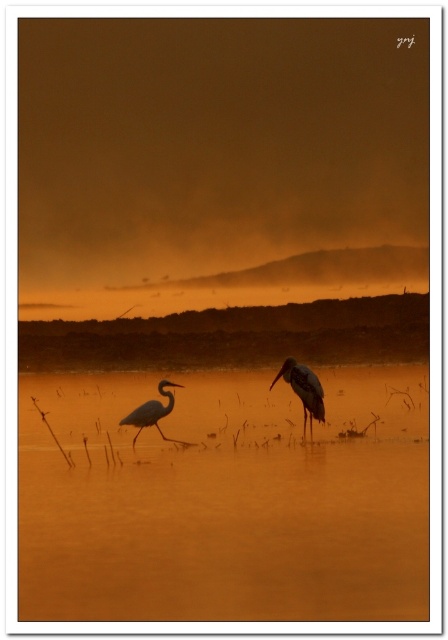
Who is more distant from viewer, (363, 577) or (318, 384)?

The point (318, 384) is behind.

Image resolution: width=448 pixels, height=640 pixels. Identify the location of golden smooth water at center. (225, 500).

Does point (358, 474) come closer to viewer compared to point (171, 404)?

Yes, it is.

Between golden smooth water at center and matte black heron at left, which one has less height?

matte black heron at left is shorter.

Where is `golden smooth water at center`? Image resolution: width=448 pixels, height=640 pixels. golden smooth water at center is located at coordinates (225, 500).

This screenshot has height=640, width=448. Identify the location of golden smooth water at center. click(x=225, y=500).

How distant is smooth gray heron at center from matte black heron at left?

smooth gray heron at center and matte black heron at left are 1.75 meters apart from each other.

At what (x,y) coordinates should I click in order to perform the action: click on smooth gray heron at center. Please return your answer as a coordinate pair (x, y). The height and width of the screenshot is (640, 448). Looking at the image, I should click on (304, 388).